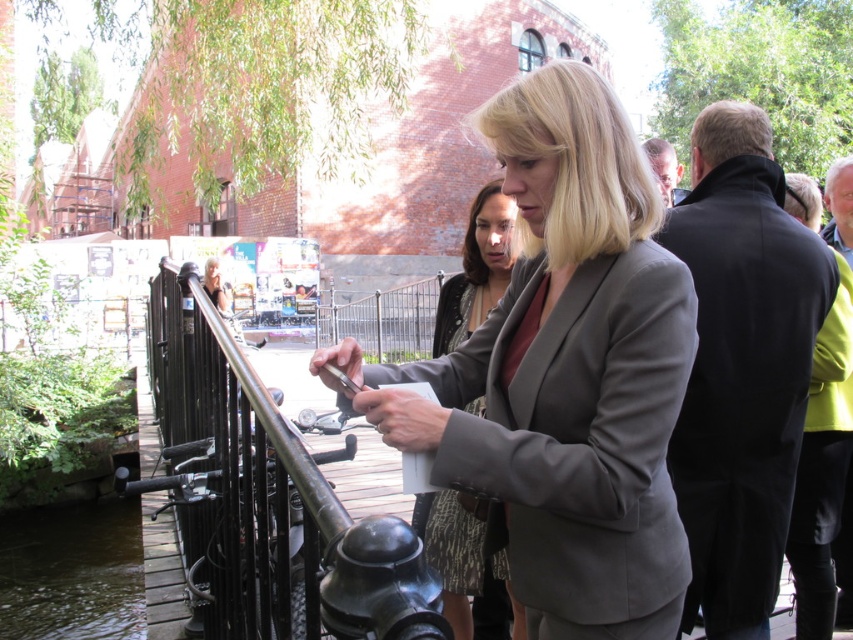
Can you confirm if matte gray blazer at center is taller than gray fabric jacket at center?

Indeed, matte gray blazer at center has a greater height compared to gray fabric jacket at center.

The image size is (853, 640). I want to click on matte gray blazer at center, so click(564, 372).

Can you confirm if matte gray blazer at center is shorter than brown liquid water at lower left?

No, matte gray blazer at center is not shorter than brown liquid water at lower left.

Who is higher up, matte gray blazer at center or brown liquid water at lower left?

matte gray blazer at center

Which is in front, point (509, 381) or point (83, 582)?

Point (509, 381) is in front.

I want to click on matte gray blazer at center, so click(564, 372).

Is black metal railing at center thinner than gray fabric jacket at center?

No, black metal railing at center is not thinner than gray fabric jacket at center.

Can you confirm if black metal railing at center is taller than gray fabric jacket at center?

Indeed, black metal railing at center has a greater height compared to gray fabric jacket at center.

This screenshot has height=640, width=853. Find the location of `black metal railing at center`. black metal railing at center is located at coordinates (267, 497).